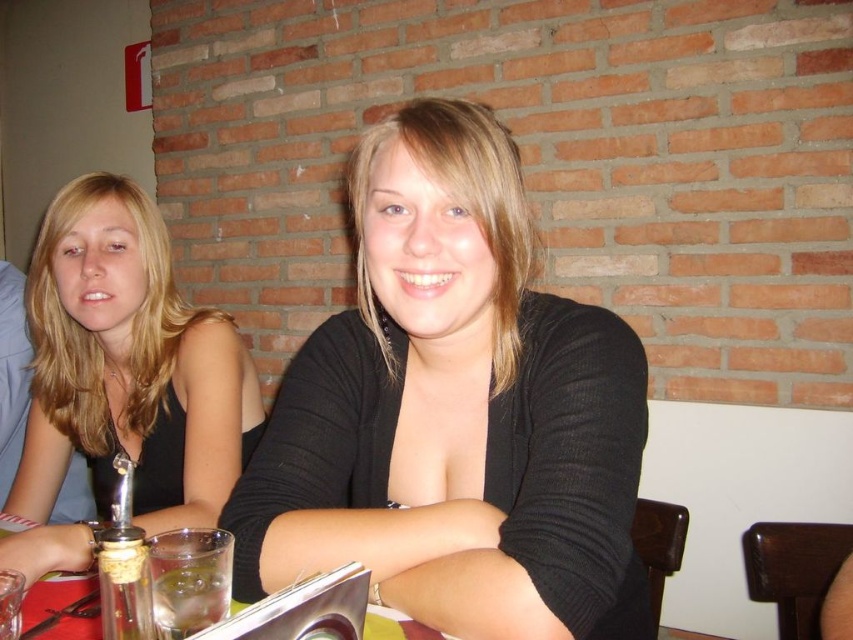
Question: Where is matte black tank top at left located in relation to clear glass at lower center in the image?

Choices:
 (A) right
 (B) left

Answer: (B)

Question: Does black matte sweater at center appear over clear glass at lower center?

Choices:
 (A) no
 (B) yes

Answer: (B)

Question: Which point is closer to the camera taking this photo?

Choices:
 (A) (381, 634)
 (B) (55, 289)

Answer: (A)

Question: Is black matte sweater at center bigger than clear glass at lower center?

Choices:
 (A) no
 (B) yes

Answer: (B)

Question: Which object is positioned closest to the black matte sweater at center?

Choices:
 (A) matte black tank top at left
 (B) clear glass at lower center

Answer: (B)

Question: Which object appears farthest from the camera in this image?

Choices:
 (A) black matte sweater at center
 (B) clear glass at lower center
 (C) matte black tank top at left

Answer: (C)